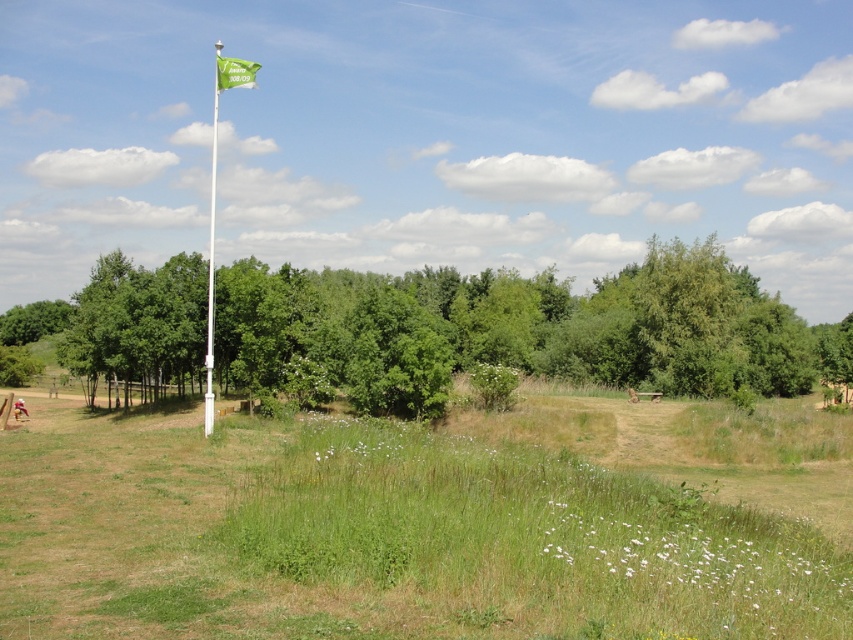
Can you confirm if green leafy tree at center is thinner than white plastic flag pole at center?

Incorrect, green leafy tree at center's width is not less than white plastic flag pole at center's.

In the scene shown: Who is more forward, [573,336] or [213,156]?

Point [573,336] is in front.

Where is `green leafy tree at center`? Image resolution: width=853 pixels, height=640 pixels. green leafy tree at center is located at coordinates [x=531, y=324].

Which of these two, white plastic flag pole at center or green fabric flag at upper center, stands taller?

Standing taller between the two is white plastic flag pole at center.

Between white plastic flag pole at center and green fabric flag at upper center, which one is positioned lower?

Positioned lower is white plastic flag pole at center.

The width and height of the screenshot is (853, 640). What do you see at coordinates (212, 266) in the screenshot?
I see `white plastic flag pole at center` at bounding box center [212, 266].

Identify the location of white plastic flag pole at center. pyautogui.click(x=212, y=266).

Does point (24, 554) come farther from viewer compared to point (756, 317)?

No, (24, 554) is in front of (756, 317).

Looking at this image, measure the distance from green grass at center to green leafy tree at center.

green grass at center and green leafy tree at center are 31.82 meters apart.

What do you see at coordinates (418, 525) in the screenshot? This screenshot has height=640, width=853. I see `green grass at center` at bounding box center [418, 525].

You are a GUI agent. You are given a task and a screenshot of the screen. Output one action in this format:
    pyautogui.click(x=<x>, y=<y>)
    Task: Click on the green grass at center
    This screenshot has width=853, height=640.
    Given the screenshot: What is the action you would take?
    pyautogui.click(x=418, y=525)